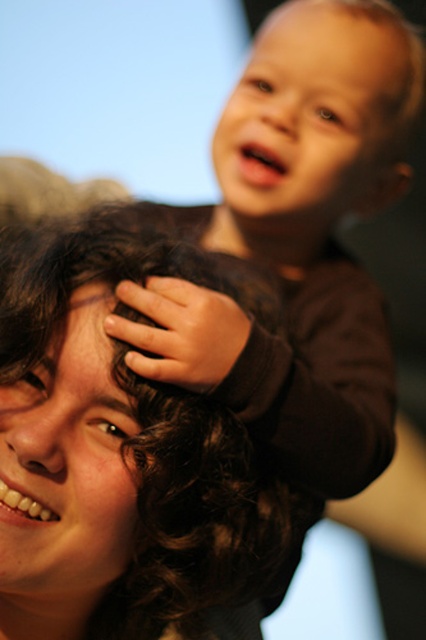
Between dark curly hair at center and smooth brown hair at upper right, which one appears on the left side from the viewer's perspective?

Positioned to the left is dark curly hair at center.

Measure the distance between point (20, 349) and camera.

A distance of 25.94 inches exists between point (20, 349) and camera.

Image resolution: width=426 pixels, height=640 pixels. I want to click on dark curly hair at center, so click(189, 512).

Image resolution: width=426 pixels, height=640 pixels. I want to click on dark curly hair at center, so click(x=189, y=512).